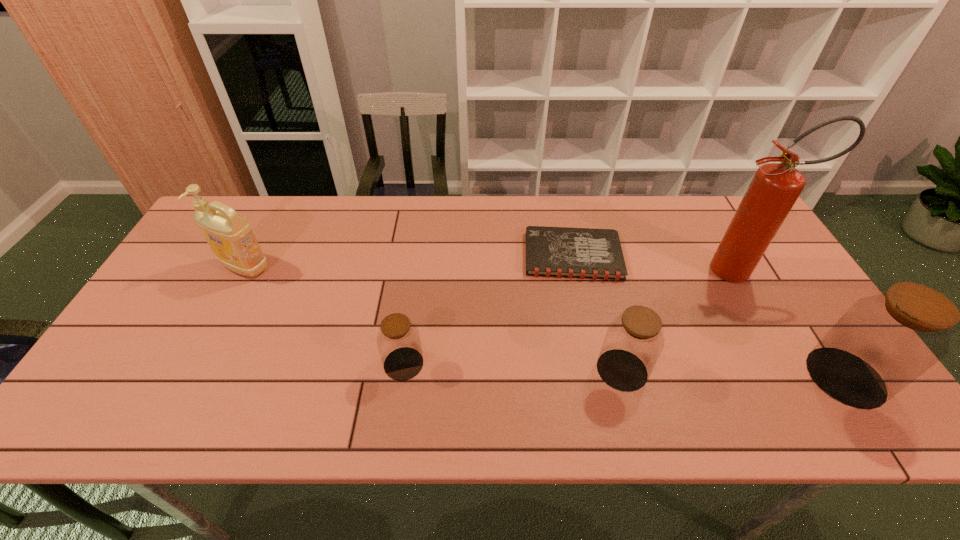
This screenshot has height=540, width=960. I want to click on object positioned at the near right corner, so click(882, 343).

The width and height of the screenshot is (960, 540). Find the location of `vacant region at the far edge of the desktop`. vacant region at the far edge of the desktop is located at coordinates (538, 195).

This screenshot has width=960, height=540. I want to click on free space at the near edge of the desktop, so click(735, 381).

Where is `free space at the near left corner of the desktop`? This screenshot has height=540, width=960. free space at the near left corner of the desktop is located at coordinates (169, 377).

Image resolution: width=960 pixels, height=540 pixels. In order to click on free region at the far right corner of the desktop in this screenshot , I will do `click(723, 233)`.

You are a GUI agent. You are given a task and a screenshot of the screen. Output one action in this format:
    pyautogui.click(x=<x>, y=<y>)
    Task: Click on the unoccupied position between the second shortest jar and the leftmost object
    The width and height of the screenshot is (960, 540).
    Given the screenshot: What is the action you would take?
    pyautogui.click(x=434, y=319)

Where is `empty location between the second shortest jar and the detergent`? empty location between the second shortest jar and the detergent is located at coordinates (434, 319).

This screenshot has height=540, width=960. I want to click on free space between the shortest jar and the shortest object, so click(x=489, y=309).

Locate an element on the screen. blank region between the third shortest object and the tallest jar is located at coordinates (733, 373).

What are the coordinates of `free spot between the rightmost jar and the shortest object` in the screenshot? It's located at (709, 316).